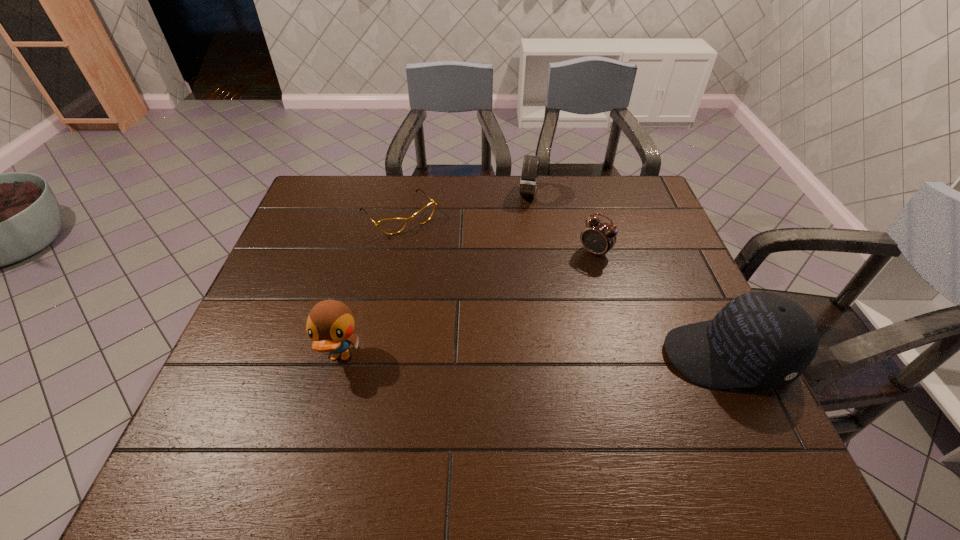
Find the location of a particular element. This screenshot has height=540, width=960. free spot on the desktop that is between the duck and the baseball cap and is positioned on the front-facing side of the shortest object is located at coordinates (516, 356).

Identify the location of free space on the desktop that is between the duck and the rightmost object and is positioned on the face of the watch. (494, 356).

Locate an element on the screen. free space on the desktop that is between the duck and the rightmost object and is positioned on the face of the third nearest object is located at coordinates (494, 356).